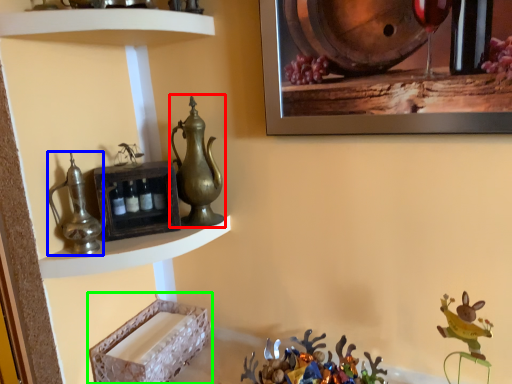
Question: Which is farther away from jug (highlighted by a red box)? jug (highlighted by a blue box) or shelf (highlighted by a green box)?

Choices:
 (A) jug
 (B) shelf

Answer: (B)